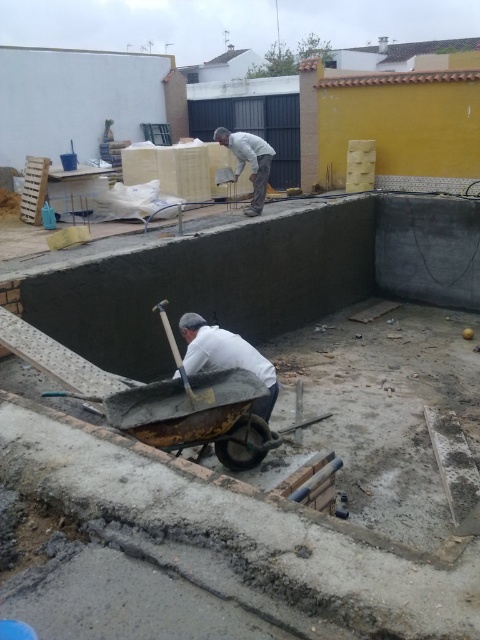
Is rusty metal cart at center above white matte shirt at upper center?

Actually, rusty metal cart at center is below white matte shirt at upper center.

Between point (256, 460) and point (249, 134), which one is positioned in front?

Point (256, 460)

Identify the location of rusty metal cart at center. (196, 413).

Is white matte shirt at center thinner than white matte shirt at upper center?

Correct, white matte shirt at center's width is less than white matte shirt at upper center's.

Does white matte shirt at center have a smaller size compared to white matte shirt at upper center?

Yes, white matte shirt at center is smaller than white matte shirt at upper center.

Find the location of a particular element. The image size is (480, 640). white matte shirt at center is located at coordinates (226, 356).

Is the position of concrete wheelbarrow at center less distant than that of rusty metal cart at center?

No.

Does concrete wheelbarrow at center come behind rusty metal cart at center?

That is True.

Between point (170, 433) and point (241, 400), which one is positioned behind?

Positioned behind is point (241, 400).

Locate an element on the screen. Image resolution: width=480 pixels, height=640 pixels. concrete wheelbarrow at center is located at coordinates (158, 401).